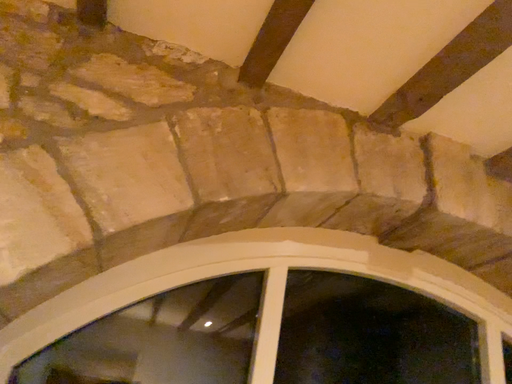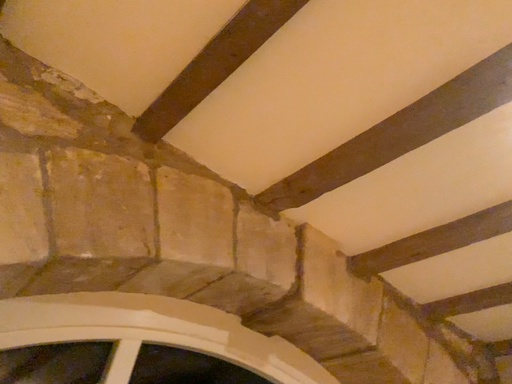
Question: How did the camera likely rotate when shooting the video?

Choices:
 (A) rotated downward
 (B) rotated upward

Answer: (B)